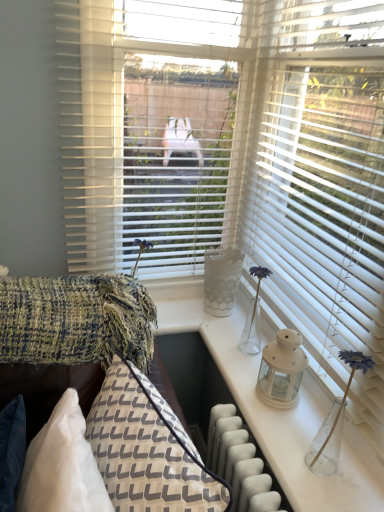
Question: From a real-world perspective, is textured woolen blanket at left located higher than matte white lantern at right?

Choices:
 (A) yes
 (B) no

Answer: (A)

Question: Is textured woolen blanket at left taller than matte white lantern at right?

Choices:
 (A) no
 (B) yes

Answer: (A)

Question: Can we say textured woolen blanket at left lies outside matte white lantern at right?

Choices:
 (A) yes
 (B) no

Answer: (A)

Question: Considering the relative positions of textured woolen blanket at left and matte white lantern at right in the image provided, is textured woolen blanket at left to the left of matte white lantern at right from the viewer's perspective?

Choices:
 (A) yes
 (B) no

Answer: (A)

Question: From a real-world perspective, does textured woolen blanket at left sit lower than matte white lantern at right?

Choices:
 (A) yes
 (B) no

Answer: (B)

Question: Is point (39, 489) closer or farther from the camera than point (352, 354)?

Choices:
 (A) farther
 (B) closer

Answer: (B)

Question: Is textured woven pillow at lower left situated inside matte white lantern at right or outside?

Choices:
 (A) inside
 (B) outside

Answer: (B)

Question: From the image's perspective, relative to matte white lantern at right, is textured woven pillow at lower left above or below?

Choices:
 (A) above
 (B) below

Answer: (B)

Question: Considering the relative positions of textured woven pillow at lower left and matte white lantern at right in the image provided, is textured woven pillow at lower left to the left or to the right of matte white lantern at right?

Choices:
 (A) left
 (B) right

Answer: (A)

Question: Is textured woven couch at lower left to the left or to the right of matte white lantern at right in the image?

Choices:
 (A) left
 (B) right

Answer: (A)

Question: From a real-world perspective, is textured woven couch at lower left physically located above or below matte white lantern at right?

Choices:
 (A) below
 (B) above

Answer: (A)

Question: Is textured woven couch at lower left bigger or smaller than matte white lantern at right?

Choices:
 (A) big
 (B) small

Answer: (A)

Question: Does point (114, 313) appear closer or farther from the camera than point (360, 360)?

Choices:
 (A) farther
 (B) closer

Answer: (A)

Question: Do you think white matte lantern at center is within textured woven couch at lower left, or outside of it?

Choices:
 (A) inside
 (B) outside

Answer: (B)

Question: In the image, is white matte lantern at center positioned in front of or behind textured woven couch at lower left?

Choices:
 (A) front
 (B) behind

Answer: (B)